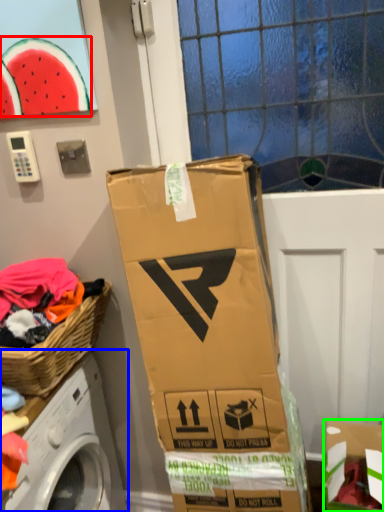
Question: Estimate the real-world distances between objects in this image. Which object is closer to watermelon (highlighted by a red box), washing machine (highlighted by a blue box) or cardboard box (highlighted by a green box)?

Choices:
 (A) washing machine
 (B) cardboard box

Answer: (A)